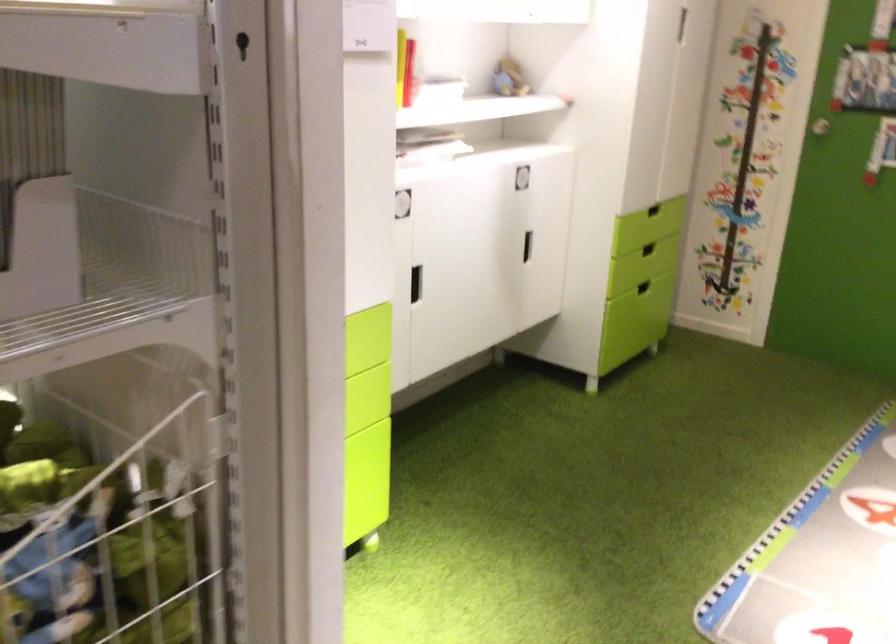
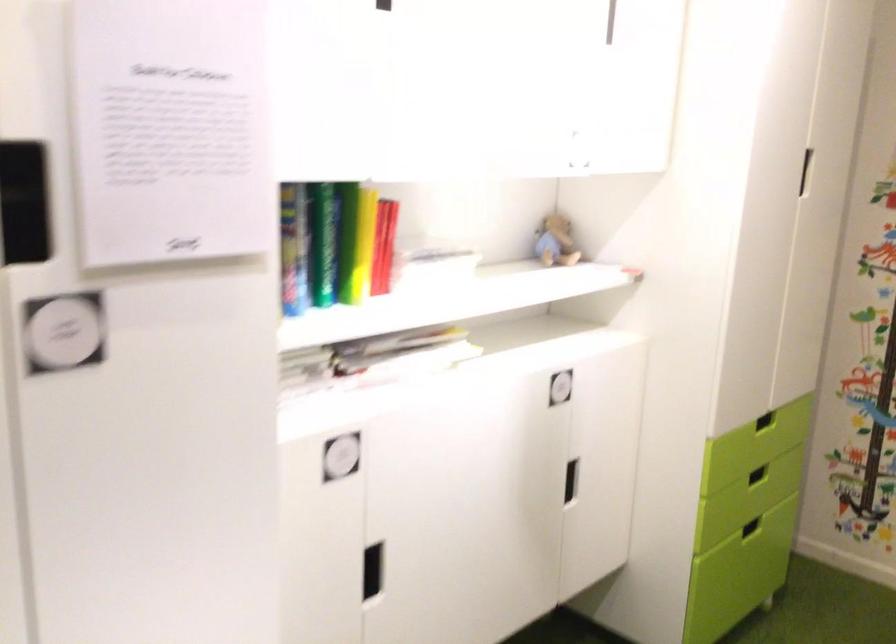
Question: What movement of the cameraman would produce the second image?

Choices:
 (A) Left
 (B) Right
 (C) Forward
 (D) Backward

Answer: (C)